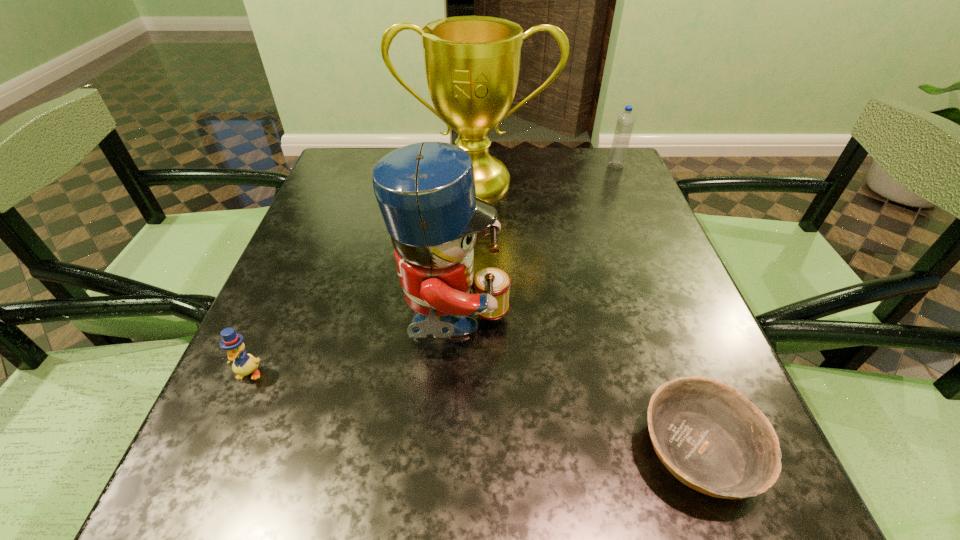
At what (x,y) coordinates should I click in order to perform the action: click on vacant space located 0.090m on the face of the fourth tallest object, where the monocle is placed. Please return your answer as a coordinate pair (x, y). This screenshot has width=960, height=540. Looking at the image, I should click on pos(220,437).

At what (x,y) coordinates should I click in order to perform the action: click on free spot located on the left of the shortest object. Please return your answer as a coordinate pair (x, y). The width and height of the screenshot is (960, 540). Looking at the image, I should click on [447, 450].

Where is `award located at the far edge`? This screenshot has height=540, width=960. award located at the far edge is located at coordinates (472, 63).

Where is `water bottle that is at the far edge`? water bottle that is at the far edge is located at coordinates (625, 122).

Image resolution: width=960 pixels, height=540 pixels. I want to click on object that is positioned at the near edge, so click(x=710, y=437).

Locate an element on the screen. The width and height of the screenshot is (960, 540). object that is at the left edge is located at coordinates (243, 364).

You are a GUI agent. You are given a task and a screenshot of the screen. Output one action in this format:
    pyautogui.click(x=<x>, y=<y>)
    Task: Click on the water bottle located at the right edge
    Image resolution: width=960 pixels, height=540 pixels.
    Given the screenshot: What is the action you would take?
    pyautogui.click(x=625, y=122)

The height and width of the screenshot is (540, 960). Find the location of `bowl that is at the right edge`. bowl that is at the right edge is located at coordinates (710, 437).

Identify the location of object situated at the far right corner. (625, 122).

The image size is (960, 540). Identify the location of object situated at the near right corner. (710, 437).